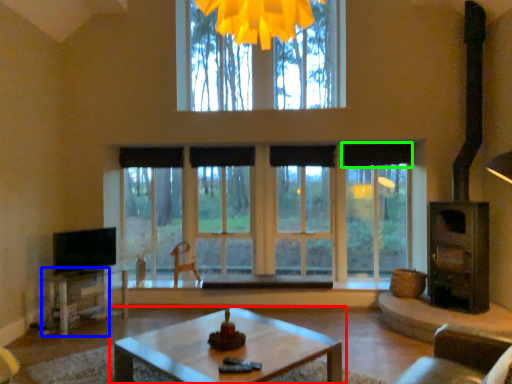
Question: Which object is positioned farthest from coffee table (highlighted by a red box)? Select from table (highlighted by a blue box) and curtain (highlighted by a green box).

Choices:
 (A) table
 (B) curtain

Answer: (B)